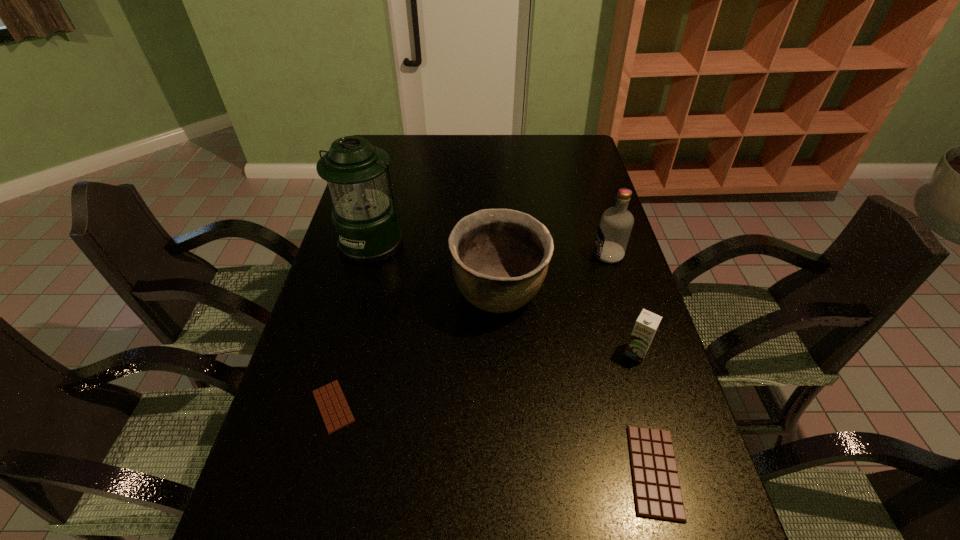
If equal spacing is the goal by inserting an additional candy_bar among them, please point out a vacant space for this new candy_bar. Please provide its 2D coordinates. Your answer should be formatted as a tuple, i.e. [(x, y)], where the tuple contains the x and y coordinates of a point satisfying the conditions above.

[(485, 437)]